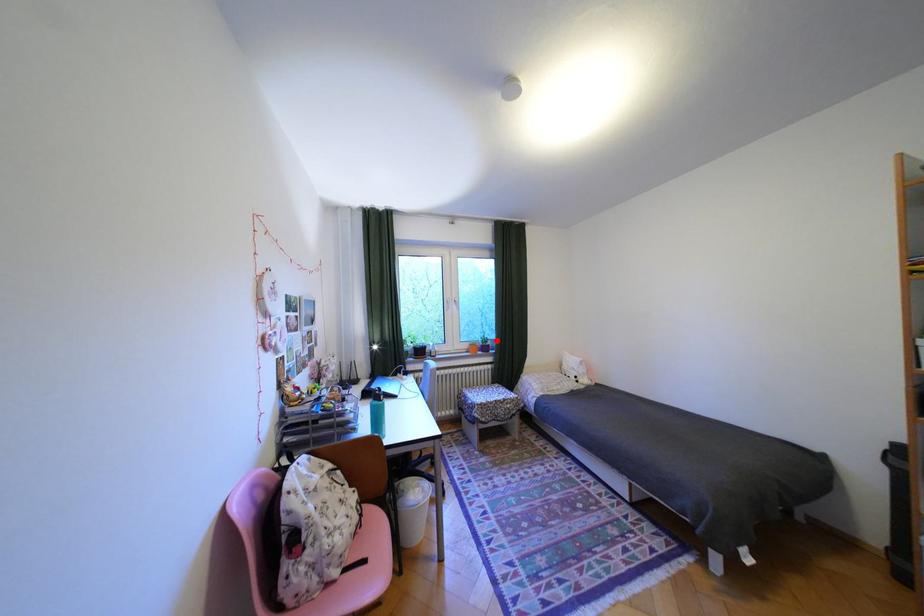
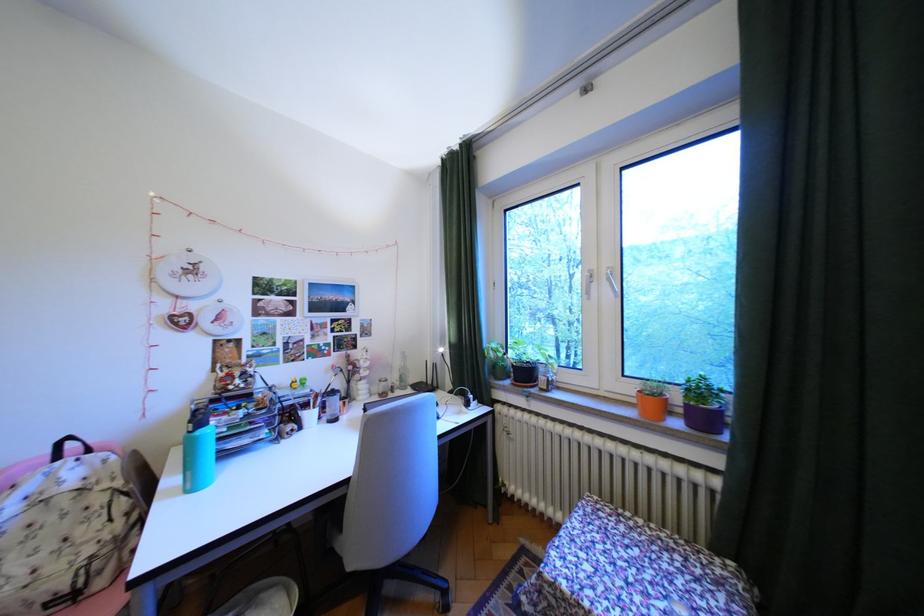
Find the pixel in the second image that matches the highlighted location in the first image.

(710, 391)